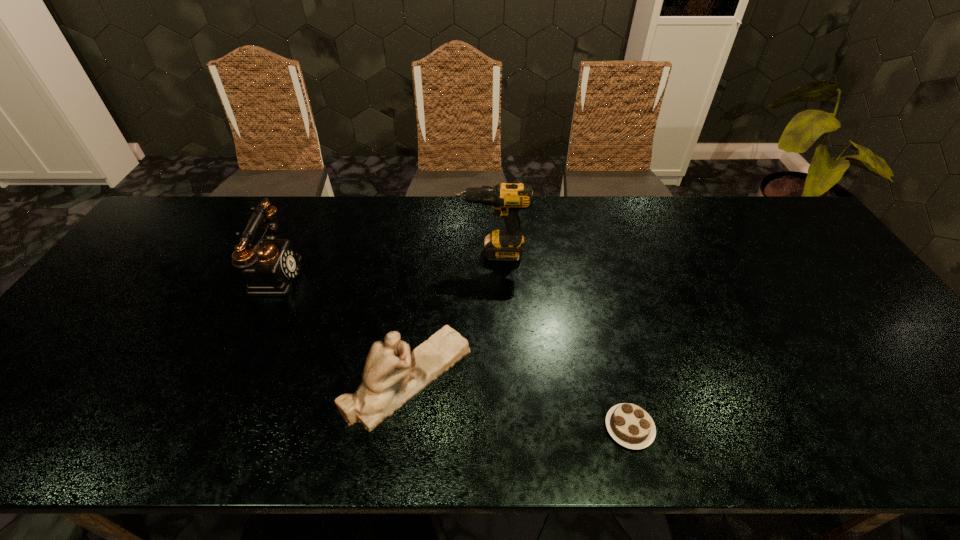
Where is `free spot located on the front-facing side of the third tallest object`? free spot located on the front-facing side of the third tallest object is located at coordinates (589, 377).

The image size is (960, 540). I want to click on vacant space located 0.330m on the right of the chocolate cake, so click(x=807, y=428).

The image size is (960, 540). Find the location of `figurine located in the near edge section of the desktop`. figurine located in the near edge section of the desktop is located at coordinates (392, 376).

Where is `chocolate cake present at the near edge`? chocolate cake present at the near edge is located at coordinates (629, 425).

Find the location of `vacant area at the far edge of the desktop`. vacant area at the far edge of the desktop is located at coordinates (466, 202).

Locate an element on the screen. vacant space at the near edge of the desktop is located at coordinates (303, 424).

What are the coordinates of `free region at the left edge of the desktop` in the screenshot? It's located at (144, 272).

In the image, there is a desktop. Where is `vacant region at the right edge`? Image resolution: width=960 pixels, height=540 pixels. vacant region at the right edge is located at coordinates (876, 376).

Identify the location of free space at the far right corner of the desktop. The height and width of the screenshot is (540, 960). (774, 211).

Identify the location of vacant area that lies between the figurine and the third shortest object. (341, 326).